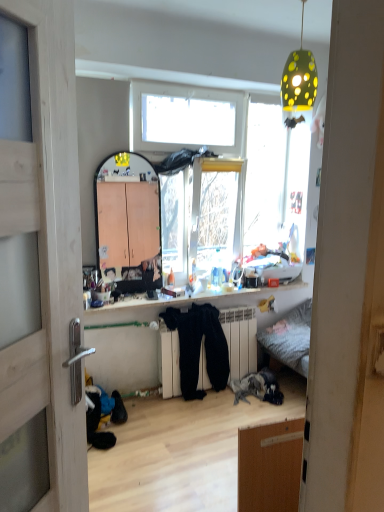
Question: Is white matte radiator at center inside the boundaries of shiny plastic shelf at center, or outside?

Choices:
 (A) inside
 (B) outside

Answer: (B)

Question: In terms of height, does white matte radiator at center look taller or shorter compared to shiny plastic shelf at center?

Choices:
 (A) tall
 (B) short

Answer: (A)

Question: Which object is positioned farthest from the shiny plastic shelf at center?

Choices:
 (A) green dotted lampshade at upper center
 (B) wooden door at left
 (C) white matte radiator at center

Answer: (B)

Question: Estimate the real-world distances between objects in this image. Which object is closer to the white matte radiator at center?

Choices:
 (A) shiny plastic shelf at center
 (B) green dotted lampshade at upper center
 (C) wooden door at left

Answer: (A)